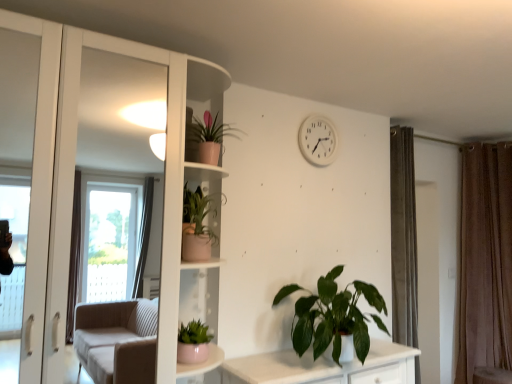
Question: Is the position of matte pink pot at lower center, which is counted as the 1th houseplant, starting from the left, more distant than that of pink matte pot at upper center, which is the fourth houseplant from bottom to top?

Choices:
 (A) yes
 (B) no

Answer: (B)

Question: Does matte pink pot at lower center, the 3th houseplant from the top, have a greater width compared to pink matte pot at upper center, the first houseplant viewed from the top?

Choices:
 (A) no
 (B) yes

Answer: (B)

Question: From a real-world perspective, is matte pink pot at lower center, acting as the second houseplant starting from the bottom, positioned under pink matte pot at upper center, which is the fourth houseplant from bottom to top, based on gravity?

Choices:
 (A) no
 (B) yes

Answer: (B)

Question: Considering the relative positions of matte pink pot at lower center, placed as the 4th houseplant when sorted from right to left, and pink matte pot at upper center, which appears as the third houseplant when viewed from the left, in the image provided, is matte pink pot at lower center, placed as the 4th houseplant when sorted from right to left, to the right of pink matte pot at upper center, which appears as the third houseplant when viewed from the left, from the viewer's perspective?

Choices:
 (A) no
 (B) yes

Answer: (A)

Question: Considering the relative sizes of matte pink pot at lower center, placed as the 4th houseplant when sorted from right to left, and pink matte pot at upper center, which appears as the third houseplant when viewed from the left, in the image provided, is matte pink pot at lower center, placed as the 4th houseplant when sorted from right to left, taller than pink matte pot at upper center, which appears as the third houseplant when viewed from the left,?

Choices:
 (A) yes
 (B) no

Answer: (B)

Question: Considering the relative sizes of matte pink pot at lower center, placed as the 4th houseplant when sorted from right to left, and pink matte pot at upper center, which is the fourth houseplant from bottom to top, in the image provided, is matte pink pot at lower center, placed as the 4th houseplant when sorted from right to left, thinner than pink matte pot at upper center, which is the fourth houseplant from bottom to top,?

Choices:
 (A) no
 (B) yes

Answer: (A)

Question: Could you tell me if green matte plant at lower center, which ranks as the 1th houseplant in right-to-left order, is turned towards pink matte pot at upper center, which is the fourth houseplant from bottom to top?

Choices:
 (A) no
 (B) yes

Answer: (A)

Question: Considering the relative sizes of green matte plant at lower center, the 1th houseplant from the bottom, and pink matte pot at upper center, the second houseplant viewed from the right, in the image provided, is green matte plant at lower center, the 1th houseplant from the bottom, wider than pink matte pot at upper center, the second houseplant viewed from the right,?

Choices:
 (A) no
 (B) yes

Answer: (B)

Question: From a real-world perspective, is green matte plant at lower center, the 1th houseplant from the bottom, physically below pink matte pot at upper center, which appears as the third houseplant when viewed from the left?

Choices:
 (A) yes
 (B) no

Answer: (A)

Question: Is green matte plant at lower center, acting as the 4th houseplant starting from the top, looking in the opposite direction of pink matte pot at upper center, the second houseplant viewed from the right?

Choices:
 (A) yes
 (B) no

Answer: (B)

Question: From the image's perspective, is green matte plant at lower center, the 1th houseplant from the bottom, on pink matte pot at upper center, the second houseplant viewed from the right?

Choices:
 (A) no
 (B) yes

Answer: (A)

Question: Can you confirm if green matte plant at lower center, the fourth houseplant from the left, is positioned to the right of pink matte pot at upper center, which appears as the third houseplant when viewed from the left?

Choices:
 (A) yes
 (B) no

Answer: (A)

Question: Is green matte plant at lower center, the 1th houseplant from the bottom, closer to the viewer compared to matte pink pot at lower center, the 3th houseplant from the top?

Choices:
 (A) no
 (B) yes

Answer: (A)